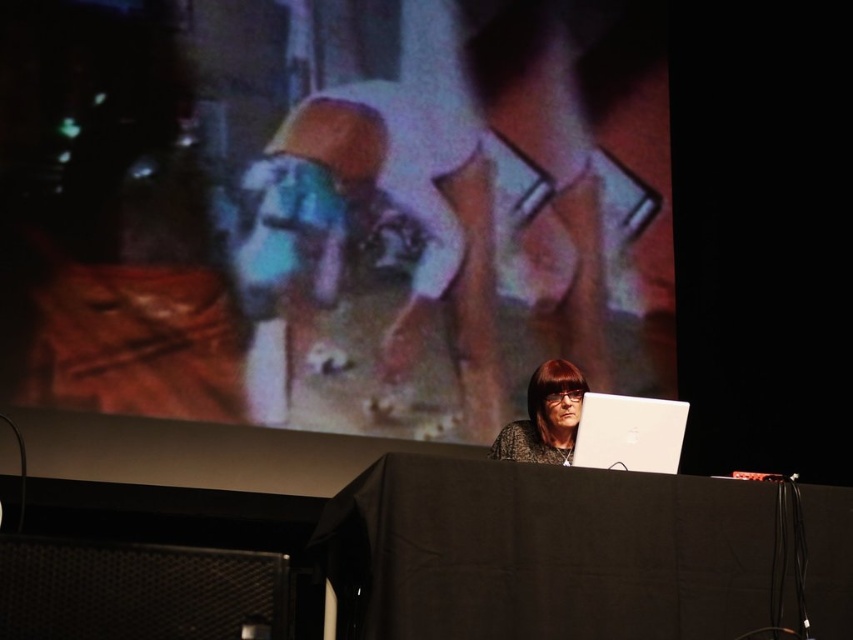
Based on the photo, you are a technician setting up for a presentation. You need to position a microphone stand exactly 2 meters away from the camera to ensure optimal sound quality. Given the current setup, will the microphone stand placed where the black mesh speaker at lower left is located be too close or just right?

The black mesh speaker at lower left is 1.54 meters from camera. Since the microphone stand needs to be placed exactly 2 meters away, the current position is too close. Move it further back to meet the required distance.

You are organizing a small event and need to place a 2.5 foot wide banner between the black matte table at center and the black mesh speaker at lower left. Can the banner fit in the space between them?

The black matte table at center might be wider than black mesh speaker at lower left, so the space between them may not be wide enough to accommodate a 2.5 foot wide banner. Check the actual dimensions before placing it.

You are standing in the lecture hall and want to place a 2.5 meter long banner on the floor between you and the black matte table at center. Will the banner fit without overlapping anything?

The distance between you and the black matte table at center is 2.44 meters. Since the banner is 2.5 meters long, it will overlap slightly with either the table or your position when placed on the floor between them.